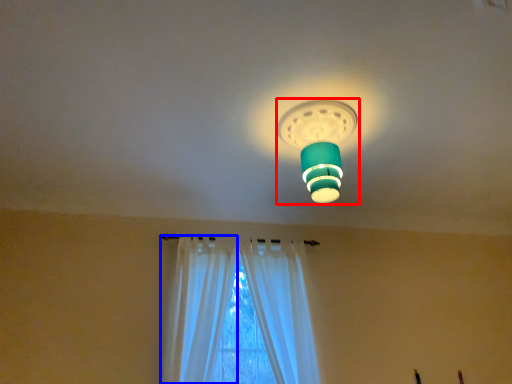
Question: Which point is further to the camera, lamp (highlighted by a red box) or curtain (highlighted by a blue box)?

Choices:
 (A) lamp
 (B) curtain

Answer: (B)